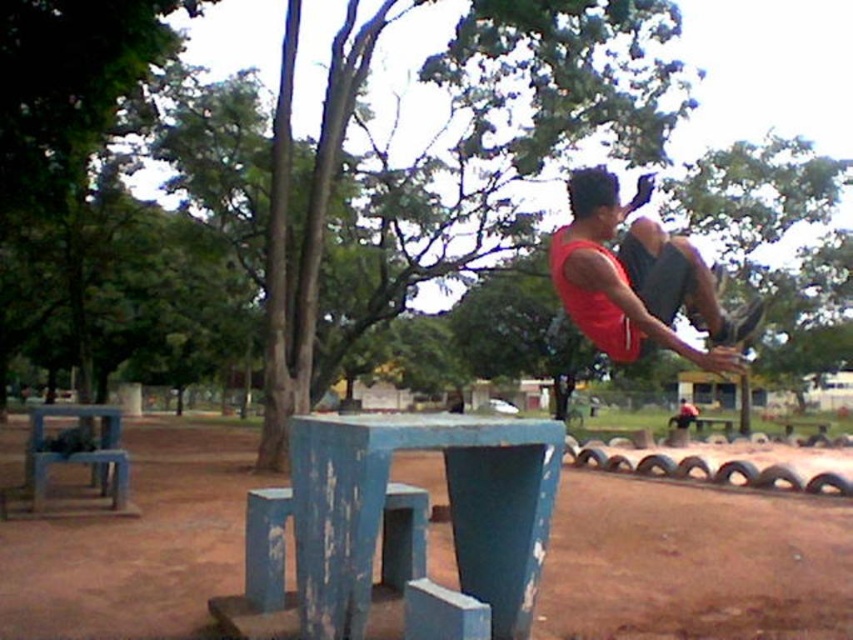
Does blue painted concrete at center appear under blue painted wood table at center?

Yes.

Does blue painted concrete at center have a lesser width compared to blue painted wood table at center?

No.

Who is more distant from viewer, (438, 456) or (387, 522)?

Positioned behind is point (438, 456).

At what (x,y) coordinates should I click in order to perform the action: click on blue painted concrete at center. Please return your answer as a coordinate pair (x, y). This screenshot has height=640, width=853. Looking at the image, I should click on (693, 563).

You are a GUI agent. You are given a task and a screenshot of the screen. Output one action in this format:
    pyautogui.click(x=<x>, y=<y>)
    Task: Click on the blue painted concrete at center
    This screenshot has width=853, height=640.
    Given the screenshot: What is the action you would take?
    pyautogui.click(x=693, y=563)

Can you confirm if blue painted concrete at center is wider than matte red tank top at upper right?

Indeed, blue painted concrete at center has a greater width compared to matte red tank top at upper right.

Locate an element on the screen. The image size is (853, 640). blue painted concrete at center is located at coordinates (x=693, y=563).

Between blue painted wood table at center and matte red tank top at upper right, which one has more height?

With more height is blue painted wood table at center.

Is point (386, 481) farther from viewer compared to point (579, 275)?

No.

Which is in front, point (300, 636) or point (665, 321)?

Point (300, 636) is more forward.

Find the location of a particular element. The height and width of the screenshot is (640, 853). blue painted wood table at center is located at coordinates (404, 518).